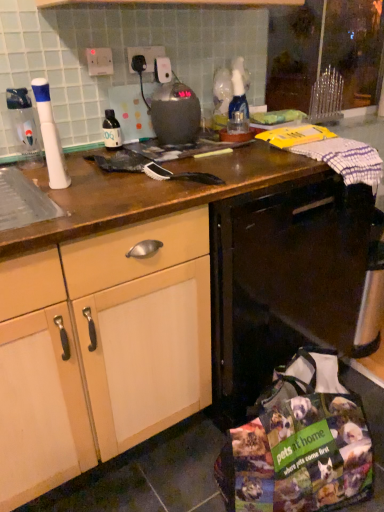
This screenshot has height=512, width=384. What do you see at coordinates (111, 130) in the screenshot? I see `matte black bottle at center, acting as the 1th bottle starting from the right` at bounding box center [111, 130].

Consider the image. In order to face matte black bottle at center, placed as the second bottle when sorted from left to right, should I rotate leftwards or rightwards?

A 10.706 degree turn to the left will do.

Describe the element at coordinates (99, 61) in the screenshot. The image size is (384, 512). I see `white plastic electric outlet at upper center, the first electric outlet from the left` at that location.

What is the approximate width of black glossy dishwasher at center?

The width of black glossy dishwasher at center is 28.22 inches.

The width and height of the screenshot is (384, 512). What do you see at coordinates (50, 136) in the screenshot? I see `white plastic toothbrush at left` at bounding box center [50, 136].

At what (x,y) coordinates should I click in order to perform the action: click on matte black bottle at center, which ranks as the second bottle in front-to-back order. Please return your answer as a coordinate pair (x, y). Image resolution: width=384 pixels, height=512 pixels. Looking at the image, I should click on (111, 130).

How distant is white plastic toothbrush at left from metallic gray kettle at center?

The distance of white plastic toothbrush at left from metallic gray kettle at center is 16.76 inches.

From a real-world perspective, is white plastic toothbrush at left beneath metallic gray kettle at center?

Incorrect, from a real-world perspective, white plastic toothbrush at left is higher than metallic gray kettle at center.

At what (x,y) coordinates should I click in order to perform the action: click on appliance above the white plastic toothbrush at left (from the image's perspective). Please return your answer as a coordinate pair (x, y). Looking at the image, I should click on (175, 113).

Which object is closer to the camera taking this photo, white plastic toothbrush at left or metallic gray kettle at center?

Positioned in front is white plastic toothbrush at left.

From a real-world perspective, between matte black bottle at center, acting as the 1th bottle starting from the right, and white plastic socket at upper center, acting as the second electric outlet starting from the left, who is vertically higher?

From a 3D spatial view, white plastic socket at upper center, acting as the second electric outlet starting from the left, is above.

Considering the relative sizes of matte black bottle at center, which ranks as the second bottle in front-to-back order, and white plastic socket at upper center, marked as the 1th electric outlet in a right-to-left arrangement, in the image provided, is matte black bottle at center, which ranks as the second bottle in front-to-back order, smaller than white plastic socket at upper center, marked as the 1th electric outlet in a right-to-left arrangement,?

No.

The image size is (384, 512). Find the location of `the 1st bottle positioned below the white plastic socket at upper center, marked as the 1th electric outlet in a right-to-left arrangement (from the image's perspective)`. the 1st bottle positioned below the white plastic socket at upper center, marked as the 1th electric outlet in a right-to-left arrangement (from the image's perspective) is located at coordinates [x=111, y=130].

Measure the distance from transparent plastic bottle at left, the 1th bottle positioned from the left, to white plastic socket at upper center, marked as the 1th electric outlet in a right-to-left arrangement.

The distance of transparent plastic bottle at left, the 1th bottle positioned from the left, from white plastic socket at upper center, marked as the 1th electric outlet in a right-to-left arrangement, is 40.93 centimeters.

Who is taller, transparent plastic bottle at left, the 1th bottle positioned from the left, or white plastic socket at upper center, marked as the 1th electric outlet in a right-to-left arrangement?

transparent plastic bottle at left, the 1th bottle positioned from the left, is taller.

In terms of width, does transparent plastic bottle at left, which is the second bottle from right to left, look wider or thinner when compared to white plastic socket at upper center, acting as the second electric outlet starting from the left?

Clearly, transparent plastic bottle at left, which is the second bottle from right to left, has more width compared to white plastic socket at upper center, acting as the second electric outlet starting from the left.

Considering the relative sizes of transparent plastic bottle at left, which is the 1th bottle from front to back, and white plastic socket at upper center, acting as the second electric outlet starting from the left, in the image provided, is transparent plastic bottle at left, which is the 1th bottle from front to back, bigger than white plastic socket at upper center, acting as the second electric outlet starting from the left,?

Yes.

Which is behind, point (44, 125) or point (97, 53)?

The point (97, 53) is more distant.

Does white plastic toothbrush at left have a lesser width compared to white plastic electric outlet at upper center, the 2th electric outlet in the right-to-left sequence?

No.

Is white plastic toothbrush at left situated inside white plastic electric outlet at upper center, the first electric outlet from the left, or outside?

white plastic toothbrush at left is not inside white plastic electric outlet at upper center, the first electric outlet from the left, it's outside.

Is matte black bottle at center, placed as the second bottle when sorted from left to right, completely or partially outside of metallic gray kettle at center?

Yes.

Could you tell me if matte black bottle at center, acting as the 1th bottle starting from the right, is facing metallic gray kettle at center?

No, matte black bottle at center, acting as the 1th bottle starting from the right, is not turned towards metallic gray kettle at center.

Locate an element on the screen. This screenshot has height=512, width=384. appliance located above the matte black bottle at center, arranged as the 1th bottle when viewed from the back (from the image's perspective) is located at coordinates (175, 113).

Is transparent plastic bottle at left, the 1th bottle positioned from the left, turned away from matte black bottle at center, which ranks as the second bottle in front-to-back order?

transparent plastic bottle at left, the 1th bottle positioned from the left, is not turned away from matte black bottle at center, which ranks as the second bottle in front-to-back order.

Is transparent plastic bottle at left, which is the 1th bottle from front to back, positioned beyond the bounds of matte black bottle at center, acting as the 1th bottle starting from the right?

transparent plastic bottle at left, which is the 1th bottle from front to back, lies outside matte black bottle at center, acting as the 1th bottle starting from the right,'s area.

In the image, there is a transparent plastic bottle at left, positioned as the 2th bottle in back-to-front order. At what (x,y) coordinates should I click in order to perform the action: click on bottle below it (from a real-world perspective). Please return your answer as a coordinate pair (x, y). Looking at the image, I should click on click(111, 130).

Can you confirm if transparent plastic bottle at left, the 1th bottle positioned from the left, is wider than matte black bottle at center, which ranks as the second bottle in front-to-back order?

Indeed, transparent plastic bottle at left, the 1th bottle positioned from the left, has a greater width compared to matte black bottle at center, which ranks as the second bottle in front-to-back order.

Which is closer to the camera, (32, 142) or (101, 74)?

Positioned in front is point (32, 142).

Is transparent plastic bottle at left, which is the 1th bottle from front to back, beside white plastic electric outlet at upper center, the first electric outlet from the left?

transparent plastic bottle at left, which is the 1th bottle from front to back, is not next to white plastic electric outlet at upper center, the first electric outlet from the left, and they're not touching.

Can white plastic electric outlet at upper center, the 2th electric outlet in the right-to-left sequence, be found inside transparent plastic bottle at left, the 1th bottle positioned from the left?

That's incorrect, white plastic electric outlet at upper center, the 2th electric outlet in the right-to-left sequence, is not inside transparent plastic bottle at left, the 1th bottle positioned from the left.

Identify the location of the 1st electric outlet above the transparent plastic bottle at left, the 1th bottle positioned from the left (from a real-world perspective). (99, 61).

Find the location of `appliance located above the white plastic toothbrush at left (from the image's perspective)`. appliance located above the white plastic toothbrush at left (from the image's perspective) is located at coordinates (175, 113).

From a real-world perspective, count 2nd electric outlets upward from the matte black bottle at center, which ranks as the second bottle in front-to-back order, and point to it. Please provide its 2D coordinates.

[(145, 56)]

From the image, which object appears to be nearer to white plastic toothbrush at left, transparent plastic bottle at left, which is the second bottle from right to left, or matte black bottle at center, which ranks as the second bottle in front-to-back order?

transparent plastic bottle at left, which is the second bottle from right to left, is closer to white plastic toothbrush at left.

Estimate the real-world distances between objects in this image. Which object is further from matte black bottle at center, arranged as the 1th bottle when viewed from the back, white plastic socket at upper center, acting as the second electric outlet starting from the left, or white plastic toothbrush at left?

white plastic toothbrush at left.

Which object lies nearer to the anchor point white plastic toothbrush at left, white plastic electric outlet at upper center, the 2th electric outlet in the right-to-left sequence, or transparent plastic bottle at left, positioned as the 2th bottle in back-to-front order?

Among the two, transparent plastic bottle at left, positioned as the 2th bottle in back-to-front order, is located nearer to white plastic toothbrush at left.

Looking at the image, which one is located closer to transparent plastic bottle at left, which is the 1th bottle from front to back, matte black bottle at center, acting as the 1th bottle starting from the right, or white plastic toothbrush at left?

white plastic toothbrush at left.

Looking at the image, which one is located further to transparent plastic bottle at left, which is the second bottle from right to left, black glossy dishwasher at center or white plastic electric outlet at upper center, the first electric outlet from the left?

black glossy dishwasher at center is further to transparent plastic bottle at left, which is the second bottle from right to left.

Which object lies further to the anchor point white plastic electric outlet at upper center, the 2th electric outlet in the right-to-left sequence, matte black bottle at center, placed as the second bottle when sorted from left to right, or metallic gray kettle at center?

metallic gray kettle at center.

Looking at the image, which one is located closer to white plastic toothbrush at left, white plastic socket at upper center, acting as the second electric outlet starting from the left, or white plastic electric outlet at upper center, the 2th electric outlet in the right-to-left sequence?

The object closer to white plastic toothbrush at left is white plastic electric outlet at upper center, the 2th electric outlet in the right-to-left sequence.

Estimate the real-world distances between objects in this image. Which object is further from white plastic electric outlet at upper center, the first electric outlet from the left, white plastic socket at upper center, marked as the 1th electric outlet in a right-to-left arrangement, or transparent plastic bottle at left, which is the 1th bottle from front to back?

Based on the image, transparent plastic bottle at left, which is the 1th bottle from front to back, appears to be further to white plastic electric outlet at upper center, the first electric outlet from the left.

I want to click on appliance that lies between white plastic socket at upper center, marked as the 1th electric outlet in a right-to-left arrangement, and black glossy dishwasher at center from top to bottom, so click(x=175, y=113).

Locate an element on the screen. bottle between white plastic electric outlet at upper center, the first electric outlet from the left, and metallic gray kettle at center, in the horizontal direction is located at coordinates (111, 130).

You are a GUI agent. You are given a task and a screenshot of the screen. Output one action in this format:
    pyautogui.click(x=<x>, y=<y>)
    Task: Click on the kitchen appliance between transparent plastic bottle at left, positioned as the 2th bottle in back-to-front order, and metallic gray kettle at center, in the horizontal direction
    This screenshot has height=512, width=384.
    Given the screenshot: What is the action you would take?
    pyautogui.click(x=50, y=136)

The image size is (384, 512). I want to click on appliance between white plastic toothbrush at left and white plastic electric outlet at upper center, the first electric outlet from the left, along the z-axis, so click(175, 113).